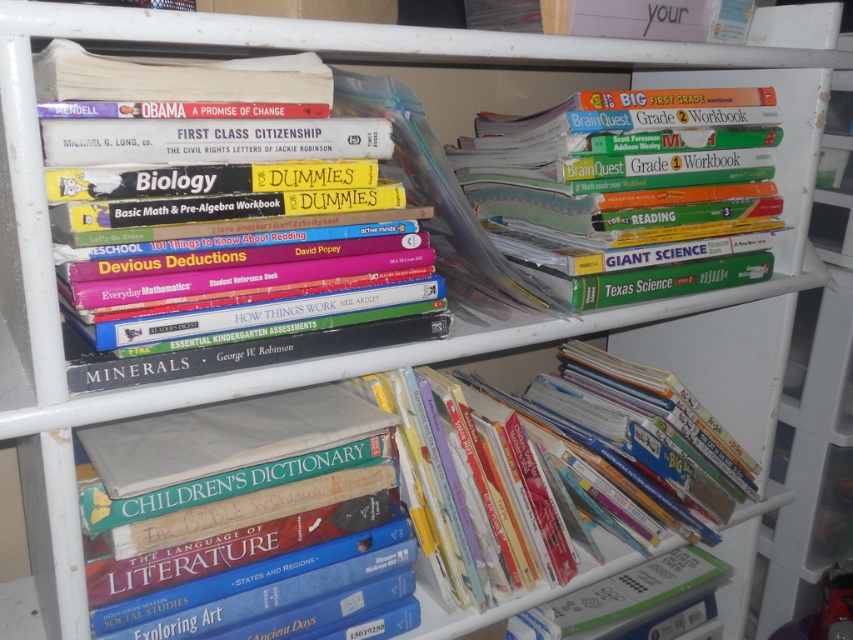
Question: Does hardcover workbook at upper right have a larger size compared to hardcover book at lower right?

Choices:
 (A) yes
 (B) no

Answer: (A)

Question: Which object is closer to the camera taking this photo?

Choices:
 (A) hardcover books at center
 (B) hardcover book at lower right

Answer: (A)

Question: Is hardcover books at center below hardcover book at lower right?

Choices:
 (A) no
 (B) yes

Answer: (A)

Question: Which object appears farthest from the camera in this image?

Choices:
 (A) hardcover book at lower right
 (B) hardcover book at upper left
 (C) hardcover workbook at upper right

Answer: (A)

Question: Where is hardcover workbook at upper right located in relation to hardcover book at lower right in the image?

Choices:
 (A) right
 (B) left

Answer: (B)

Question: Which point is farther to the camera?

Choices:
 (A) hardcover workbook at upper right
 (B) hardcover book at upper left
 (C) hardcover book at lower right
 (D) hardcover books at center

Answer: (C)